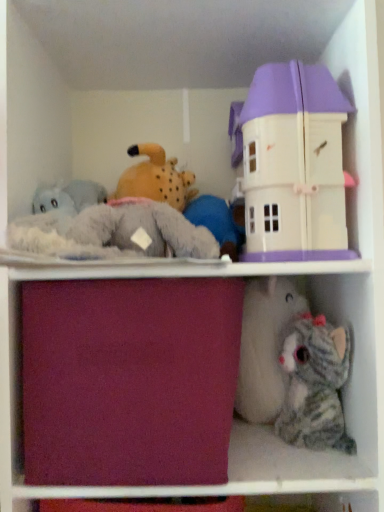
The image size is (384, 512). In order to click on pastel purple plastic dollhouse at upper right, placed as the 2th toy when sorted from bottom to top in this screenshot , I will do `click(293, 163)`.

The height and width of the screenshot is (512, 384). Find the location of `burgundy fabric drawer at center`. burgundy fabric drawer at center is located at coordinates (129, 380).

At what (x,y) coordinates should I click in order to perform the action: click on pastel purple plastic dollhouse at upper right, marked as the 1th toy in a top-to-bottom arrangement. Please return your answer as a coordinate pair (x, y). This screenshot has width=384, height=512. Looking at the image, I should click on (293, 163).

Which is in front, striped plush cat at lower right, marked as the 1th toy in a bottom-to-top arrangement, or pastel purple plastic dollhouse at upper right, marked as the 1th toy in a top-to-bottom arrangement?

pastel purple plastic dollhouse at upper right, marked as the 1th toy in a top-to-bottom arrangement.

From a real-world perspective, is striped plush cat at lower right, marked as the 1th toy in a bottom-to-top arrangement, above or below pastel purple plastic dollhouse at upper right, marked as the 1th toy in a top-to-bottom arrangement?

striped plush cat at lower right, marked as the 1th toy in a bottom-to-top arrangement, is below pastel purple plastic dollhouse at upper right, marked as the 1th toy in a top-to-bottom arrangement.

Which point is more forward, (286, 418) or (271, 164)?

The point (271, 164) is more forward.

In the scene shown: Is striped plush cat at lower right, marked as the 1th toy in a bottom-to-top arrangement, oriented away from pastel purple plastic dollhouse at upper right, placed as the 2th toy when sorted from bottom to top?

striped plush cat at lower right, marked as the 1th toy in a bottom-to-top arrangement, does not have its back to pastel purple plastic dollhouse at upper right, placed as the 2th toy when sorted from bottom to top.

Is point (287, 401) more distant than point (177, 475)?

Yes, point (287, 401) is farther from viewer.

From a real-world perspective, is striped plush cat at lower right, marked as the 1th toy in a bottom-to-top arrangement, located higher than burgundy fabric drawer at center?

Incorrect, from a real-world perspective, striped plush cat at lower right, marked as the 1th toy in a bottom-to-top arrangement, is lower than burgundy fabric drawer at center.

Is striped plush cat at lower right, the second toy from the top, oriented away from burgundy fabric drawer at center?

No, striped plush cat at lower right, the second toy from the top, is not facing away from burgundy fabric drawer at center.

Is striped plush cat at lower right, the second toy from the top, thinner than burgundy fabric drawer at center?

Yes.

From the image's perspective, does pastel purple plastic dollhouse at upper right, placed as the 2th toy when sorted from bottom to top, appear higher than striped plush cat at lower right, marked as the 1th toy in a bottom-to-top arrangement?

Yes.

Based on the photo, between pastel purple plastic dollhouse at upper right, marked as the 1th toy in a top-to-bottom arrangement, and striped plush cat at lower right, the second toy from the top, which one has more height?

pastel purple plastic dollhouse at upper right, marked as the 1th toy in a top-to-bottom arrangement, is taller.

Consider the image. Can you confirm if pastel purple plastic dollhouse at upper right, placed as the 2th toy when sorted from bottom to top, is smaller than striped plush cat at lower right, marked as the 1th toy in a bottom-to-top arrangement?

No.

Is pastel purple plastic dollhouse at upper right, marked as the 1th toy in a top-to-bottom arrangement, behind striped plush cat at lower right, the second toy from the top?

No, it is in front of striped plush cat at lower right, the second toy from the top.

Is pastel purple plastic dollhouse at upper right, placed as the 2th toy when sorted from bottom to top, with burgundy fabric drawer at center?

They are not placed beside each other.

Between pastel purple plastic dollhouse at upper right, marked as the 1th toy in a top-to-bottom arrangement, and burgundy fabric drawer at center, which one has smaller size?

pastel purple plastic dollhouse at upper right, marked as the 1th toy in a top-to-bottom arrangement.

How much distance is there between pastel purple plastic dollhouse at upper right, marked as the 1th toy in a top-to-bottom arrangement, and burgundy fabric drawer at center?

pastel purple plastic dollhouse at upper right, marked as the 1th toy in a top-to-bottom arrangement, and burgundy fabric drawer at center are 10.33 inches apart from each other.

From a real-world perspective, who is located lower, pastel purple plastic dollhouse at upper right, placed as the 2th toy when sorted from bottom to top, or burgundy fabric drawer at center?

burgundy fabric drawer at center.

Consider the image. How many degrees apart are the facing directions of burgundy fabric drawer at center and pastel purple plastic dollhouse at upper right, marked as the 1th toy in a top-to-bottom arrangement?

1.04 degrees.

Is burgundy fabric drawer at center inside or outside of pastel purple plastic dollhouse at upper right, placed as the 2th toy when sorted from bottom to top?

The correct answer is: outside.

Is burgundy fabric drawer at center aimed at pastel purple plastic dollhouse at upper right, marked as the 1th toy in a top-to-bottom arrangement?

No, burgundy fabric drawer at center is not aimed at pastel purple plastic dollhouse at upper right, marked as the 1th toy in a top-to-bottom arrangement.

Is point (216, 439) positioned behind point (277, 229)?

That is False.

From the picture: Is striped plush cat at lower right, the second toy from the top, surrounded by burgundy fabric drawer at center?

That's incorrect, striped plush cat at lower right, the second toy from the top, is not inside burgundy fabric drawer at center.

Between point (215, 358) and point (319, 382), which one is positioned in front?

The point (215, 358) is more forward.

Is burgundy fabric drawer at center directly adjacent to striped plush cat at lower right, the second toy from the top?

burgundy fabric drawer at center is not next to striped plush cat at lower right, the second toy from the top, and they're not touching.

Is burgundy fabric drawer at center bigger than striped plush cat at lower right, the second toy from the top?

Correct, burgundy fabric drawer at center is larger in size than striped plush cat at lower right, the second toy from the top.

The height and width of the screenshot is (512, 384). What are the coordinates of `toy located on the left of striped plush cat at lower right, the second toy from the top` in the screenshot? It's located at (293, 163).

Identify the location of toy that is the 2nd object to the right of the burgundy fabric drawer at center, starting at the anchor. The height and width of the screenshot is (512, 384). click(x=315, y=385).

Based on their spatial positions, is burgundy fabric drawer at center or pastel purple plastic dollhouse at upper right, marked as the 1th toy in a top-to-bottom arrangement, further from striped plush cat at lower right, the second toy from the top?

burgundy fabric drawer at center lies further to striped plush cat at lower right, the second toy from the top, than the other object.

Looking at the image, which one is located further to striped plush cat at lower right, the second toy from the top, pastel purple plastic dollhouse at upper right, placed as the 2th toy when sorted from bottom to top, or burgundy fabric drawer at center?

Based on the image, burgundy fabric drawer at center appears to be further to striped plush cat at lower right, the second toy from the top.

Which object lies further to the anchor point pastel purple plastic dollhouse at upper right, placed as the 2th toy when sorted from bottom to top, striped plush cat at lower right, the second toy from the top, or burgundy fabric drawer at center?

striped plush cat at lower right, the second toy from the top, is positioned further to the anchor pastel purple plastic dollhouse at upper right, placed as the 2th toy when sorted from bottom to top.

Based on their spatial positions, is pastel purple plastic dollhouse at upper right, marked as the 1th toy in a top-to-bottom arrangement, or striped plush cat at lower right, the second toy from the top, closer to burgundy fabric drawer at center?

pastel purple plastic dollhouse at upper right, marked as the 1th toy in a top-to-bottom arrangement.

Estimate the real-world distances between objects in this image. Which object is closer to burgundy fabric drawer at center, striped plush cat at lower right, the second toy from the top, or pastel purple plastic dollhouse at upper right, placed as the 2th toy when sorted from bottom to top?

The object closer to burgundy fabric drawer at center is pastel purple plastic dollhouse at upper right, placed as the 2th toy when sorted from bottom to top.

Considering their positions, is burgundy fabric drawer at center positioned closer to pastel purple plastic dollhouse at upper right, marked as the 1th toy in a top-to-bottom arrangement, than striped plush cat at lower right, the second toy from the top?

Based on the image, burgundy fabric drawer at center appears to be nearer to pastel purple plastic dollhouse at upper right, marked as the 1th toy in a top-to-bottom arrangement.

Locate an element on the screen. This screenshot has height=512, width=384. drawer between pastel purple plastic dollhouse at upper right, placed as the 2th toy when sorted from bottom to top, and striped plush cat at lower right, the second toy from the top, from top to bottom is located at coordinates (129, 380).